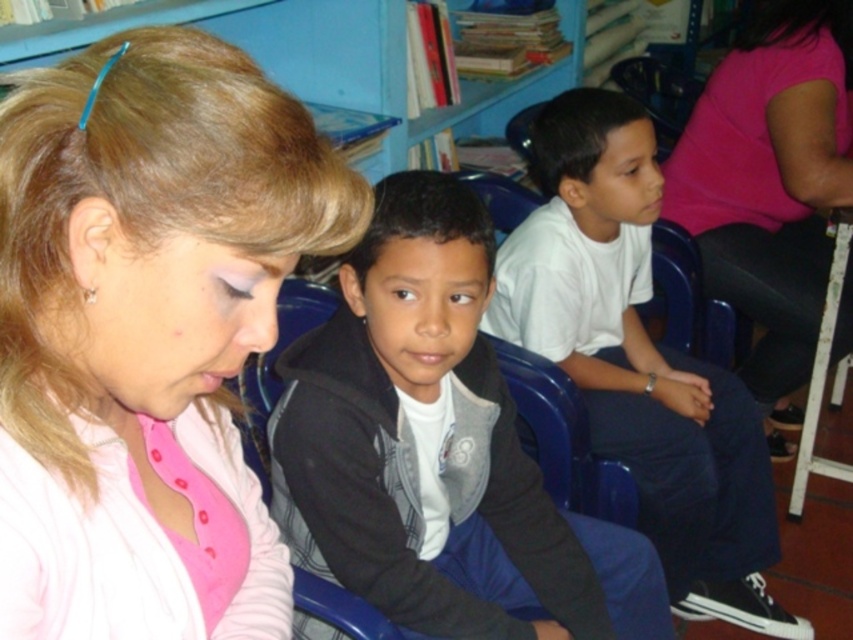
Question: Estimate the real-world distances between objects in this image. Which object is farther from the white matte shirt at center?

Choices:
 (A) pink fabric at center
 (B) pink fabric shirt at upper right
 (C) matte black hoodie at center

Answer: (A)

Question: Can you confirm if white matte shirt at center is positioned to the right of pink fabric shirt at upper right?

Choices:
 (A) yes
 (B) no

Answer: (B)

Question: Based on their relative distances, which object is nearer to the pink fabric shirt at upper right?

Choices:
 (A) white matte shirt at center
 (B) pink fabric at center
 (C) matte black hoodie at center

Answer: (A)

Question: Does white matte shirt at center appear under pink fabric shirt at upper right?

Choices:
 (A) yes
 (B) no

Answer: (A)

Question: Which object is positioned closest to the matte black hoodie at center?

Choices:
 (A) pink fabric shirt at upper right
 (B) pink fabric at center
 (C) white matte shirt at center

Answer: (B)

Question: Is pink fabric at center closer to the viewer compared to matte black hoodie at center?

Choices:
 (A) no
 (B) yes

Answer: (B)